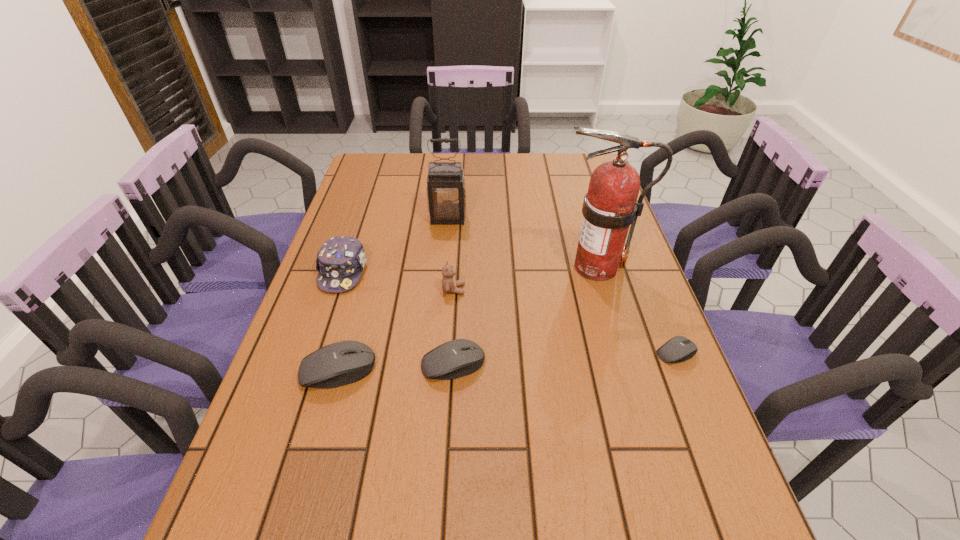
To make them evenly spaced by inserting another mouse_(computer_equipment) among them, please locate a free space for this new mouse_(computer_equipment). Please provide its 2D coordinates. Your answer should be formatted as a tuple, i.e. [(x, y)], where the tuple contains the x and y coordinates of a point satisfying the conditions above.

[(566, 359)]